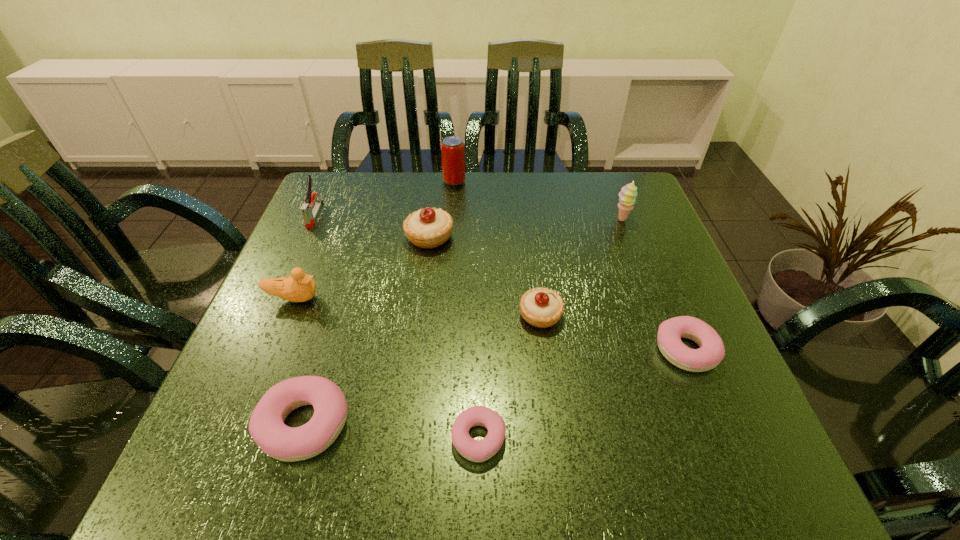
The image size is (960, 540). What are the coordinates of `the seventh tallest object` in the screenshot? It's located at click(x=266, y=426).

This screenshot has height=540, width=960. What are the coordinates of `the rightmost pastry` in the screenshot? It's located at (711, 352).

This screenshot has width=960, height=540. In order to click on the rightmost pink pastry in this screenshot , I will do `click(711, 352)`.

At what (x,y) coordinates should I click in order to perform the action: click on the shortest pastry. Please return your answer as a coordinate pair (x, y). This screenshot has height=540, width=960. Looking at the image, I should click on (474, 450).

You are a GUI agent. You are given a task and a screenshot of the screen. Output one action in this format:
    pyautogui.click(x=<x>, y=<y>)
    Task: Click on the third pastry from right to left
    The height and width of the screenshot is (540, 960).
    Given the screenshot: What is the action you would take?
    pyautogui.click(x=474, y=450)

Locate an element on the screen. The width and height of the screenshot is (960, 540). free location located on the left of the farthest object is located at coordinates (401, 181).

At what (x,y) coordinates should I click in order to perform the action: click on vacant space located 0.370m on the front of the sherbert. Please return your answer as a coordinate pair (x, y). This screenshot has width=960, height=540. Looking at the image, I should click on (668, 340).

Find the location of `vacant space located 0.400m on the handle side of the stapler`. vacant space located 0.400m on the handle side of the stapler is located at coordinates (250, 359).

I want to click on vacant space situated 0.140m on the right of the tallest pastry, so click(511, 237).

The width and height of the screenshot is (960, 540). I want to click on vacant position located on the face of the duckling, so click(x=344, y=299).